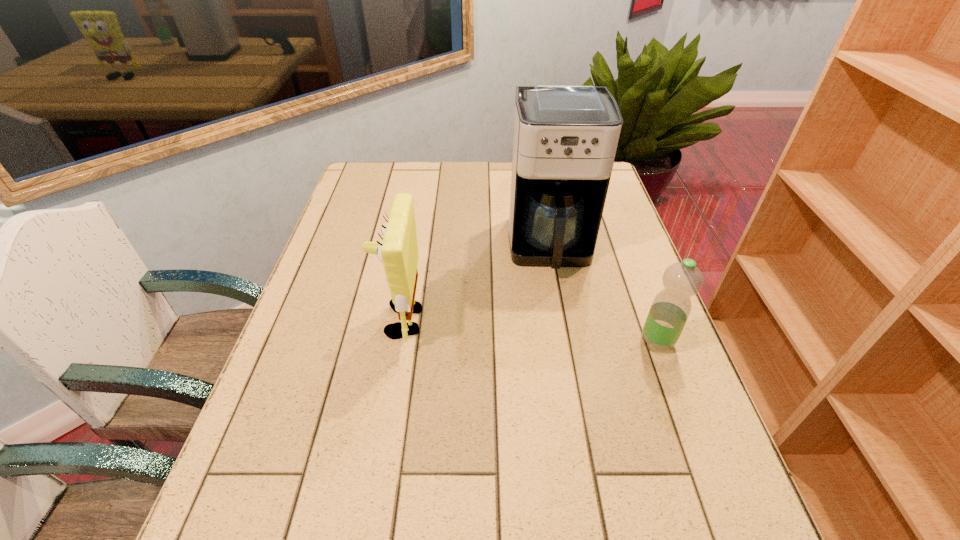
This screenshot has height=540, width=960. In order to click on free spot on the desktop that is between the leftmost object and the water bottle and is positioned on the front panel of the tallest object in this screenshot , I will do `click(563, 334)`.